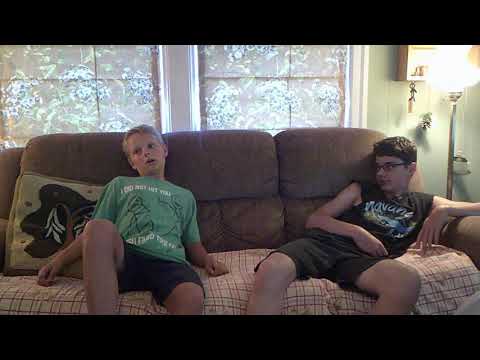
Locate an element on the screen. This screenshot has width=480, height=360. couch is located at coordinates (234, 159).